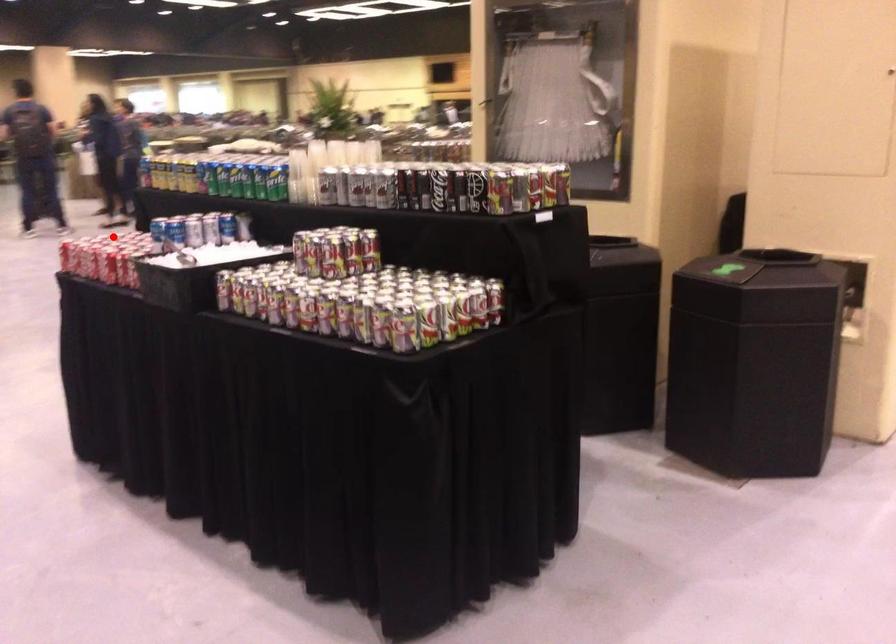
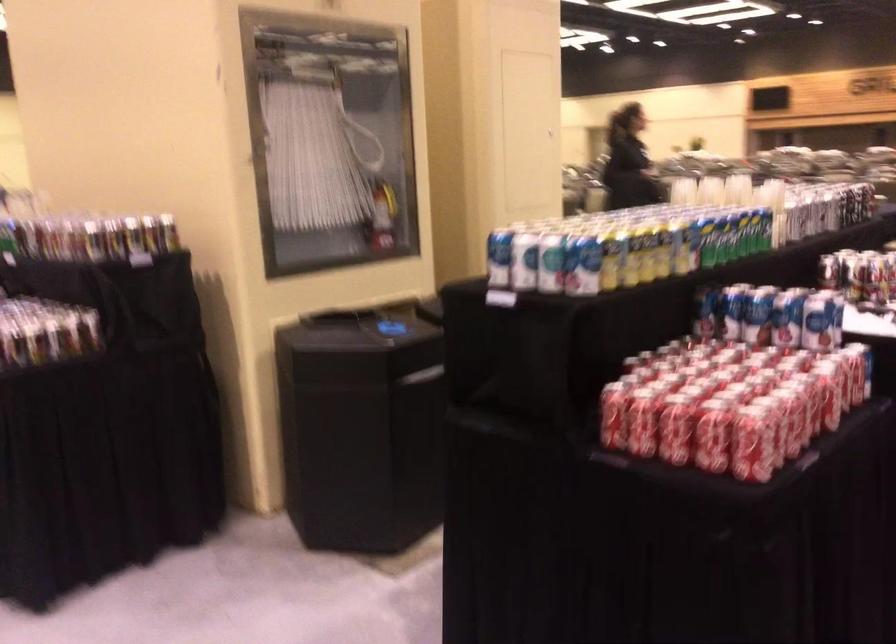
The point at the highlighted location is marked in the first image. Where is the corresponding point in the second image?

(642, 422)